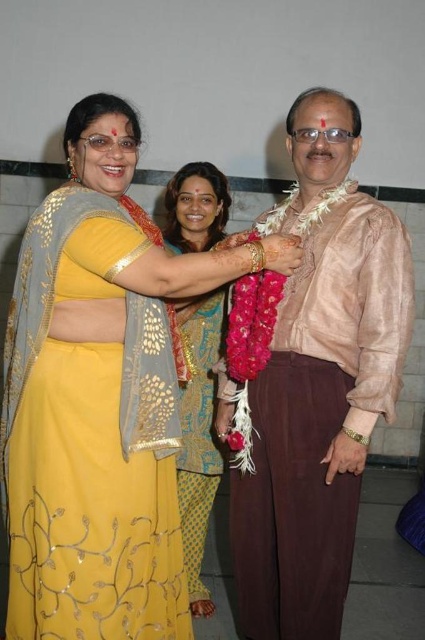
Who is positioned more to the right, yellow satin saree at center or golden sequined saree at center?

From the viewer's perspective, golden sequined saree at center appears more on the right side.

This screenshot has height=640, width=425. Find the location of `yellow satin saree at center`. yellow satin saree at center is located at coordinates (88, 456).

In the scene shown: Can you confirm if pink silk shirt at center is taller than golden sequined saree at center?

Yes, pink silk shirt at center is taller than golden sequined saree at center.

Can you confirm if pink silk shirt at center is positioned to the left of golden sequined saree at center?

Incorrect, pink silk shirt at center is not on the left side of golden sequined saree at center.

Is point (362, 339) positioned behind point (209, 467)?

No, it is in front of (209, 467).

I want to click on pink silk shirt at center, so click(x=320, y=384).

Is yellow satin saree at center to the right of pink silk shirt at center from the viewer's perspective?

In fact, yellow satin saree at center is to the left of pink silk shirt at center.

Can you confirm if yellow satin saree at center is taller than pink silk shirt at center?

In fact, yellow satin saree at center may be shorter than pink silk shirt at center.

Locate an element on the screen. Image resolution: width=425 pixels, height=640 pixels. yellow satin saree at center is located at coordinates (88, 456).

Find the location of a particular element. The width and height of the screenshot is (425, 640). yellow satin saree at center is located at coordinates (88, 456).